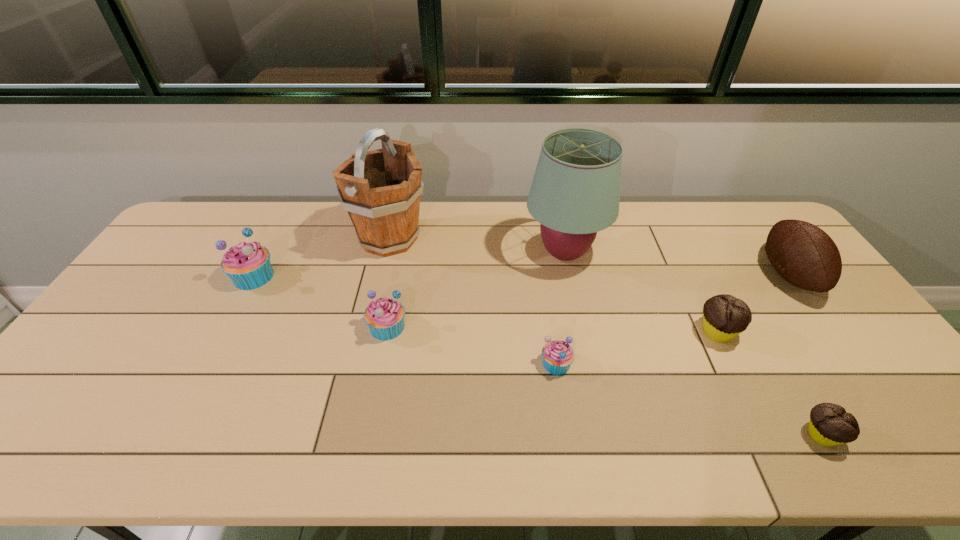
At what (x,y) coordinates should I click in order to perform the action: click on bucket. Please return your answer as a coordinate pair (x, y). The image size is (960, 540). Looking at the image, I should click on (380, 189).

What are the coordinates of `lampshade` in the screenshot? It's located at (575, 192).

Image resolution: width=960 pixels, height=540 pixels. What are the coordinates of `football` in the screenshot? It's located at (804, 255).

You are a GUI agent. You are given a task and a screenshot of the screen. Output one action in this format:
    pyautogui.click(x=<x>, y=<y>)
    Task: Click on the brown football
    
    Given the screenshot: What is the action you would take?
    pyautogui.click(x=804, y=255)

I want to click on the farthest blue muffin, so click(x=248, y=265).

At what (x,y) coordinates should I click in order to perform the action: click on the tallest muffin. Please return your answer as a coordinate pair (x, y). Looking at the image, I should click on (248, 265).

I want to click on the second blue muffin from right to left, so tap(385, 317).

Locate an element on the screen. The width and height of the screenshot is (960, 540). the second nearest blue muffin is located at coordinates (385, 317).

The width and height of the screenshot is (960, 540). I want to click on the farther chocolate muffin, so click(x=724, y=316).

The image size is (960, 540). In order to click on the fourth muffin from left to right in this screenshot , I will do `click(724, 316)`.